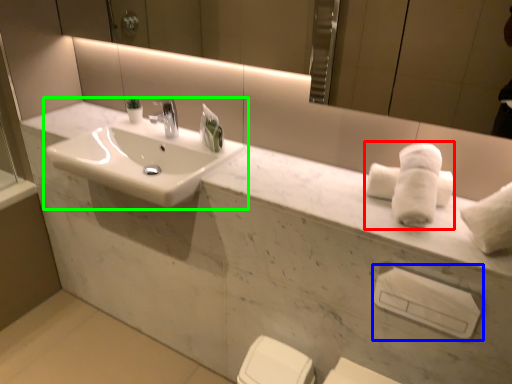
Question: Which object is positioned farthest from bath towel (highlighted by a red box)? Select from towel bar (highlighted by a blue box) and sink (highlighted by a green box).

Choices:
 (A) towel bar
 (B) sink

Answer: (B)